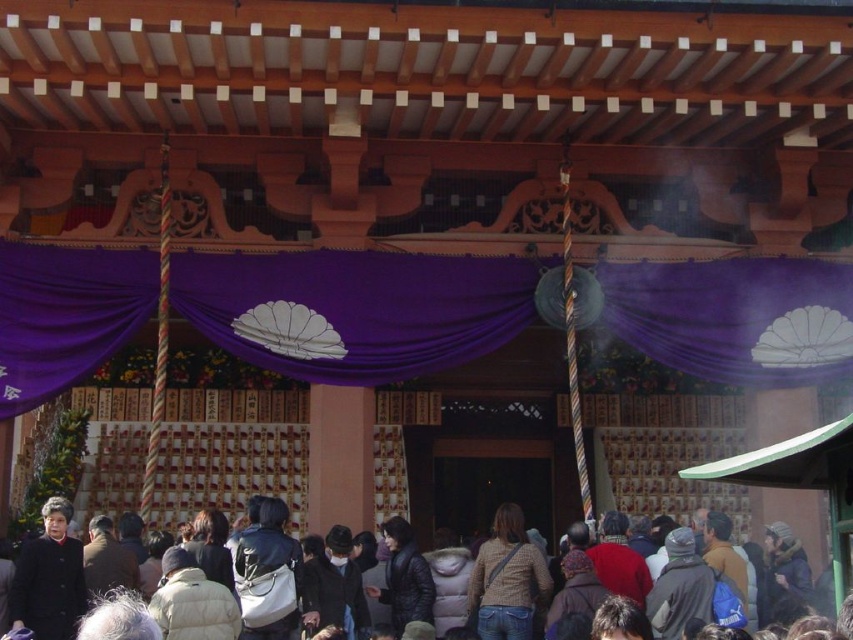
You are visiting a traditional Japanese shrine and notice two items near the entrance. You see the knitted beige sweater at center and the dark brown leather coat at lower left. Which item is positioned lower in the scene?

The knitted beige sweater at center is positioned lower than the dark brown leather coat at lower left.

You are standing at the shrine entrance and see the knitted beige sweater at center. If you want to touch the sweater, how many steps do you need to take? Assume each step covers 3 feet.

The knitted beige sweater at center and viewer are 158.61 feet apart from each other. To reach it, you would need to take approximately 53 steps since 158.61 divided by 3 equals about 52.87 steps, which rounds up to 53 steps.